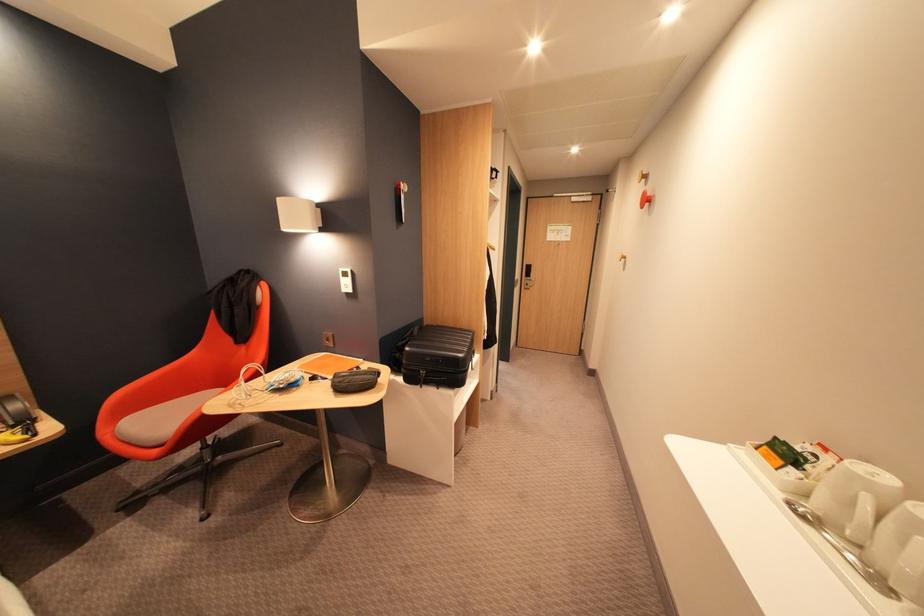
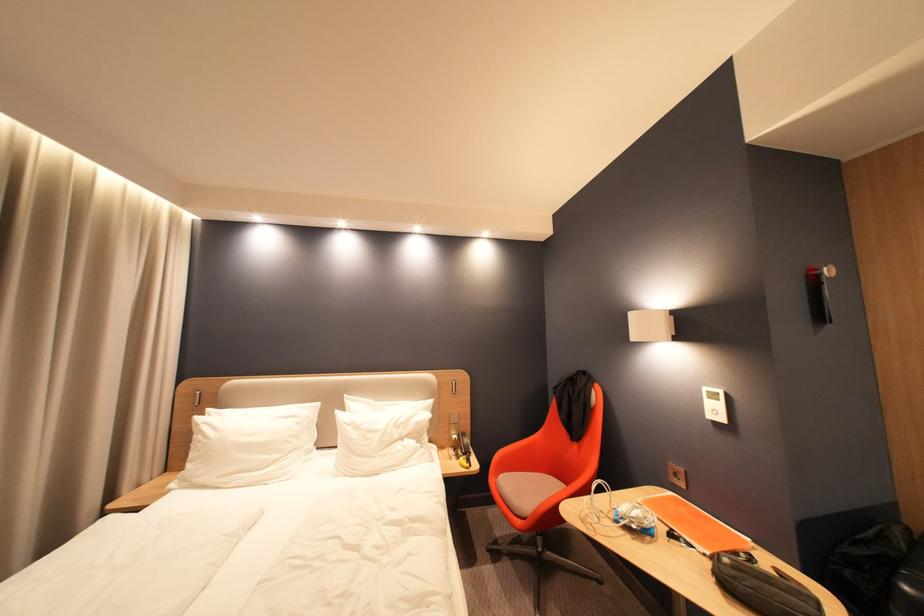
Locate, in the second image, the point that corresponds to pixel 410 185 in the first image.

(830, 270)